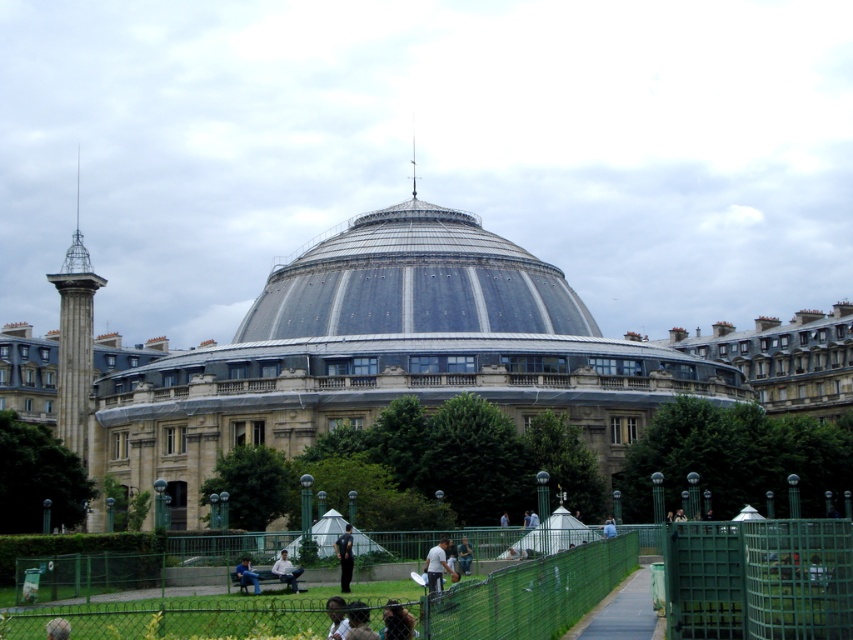
You are a visitor who wants to walk from the entrance of the building to the grassy area. You see the dark gray asphalt path at center and the light brown leather jacket at center. Which object is bigger in size and can you use it as a path?

The dark gray asphalt path at center is larger in size than the light brown leather jacket at center, so you can use the dark gray asphalt path at center as a path since it is bigger and more suitable for walking.